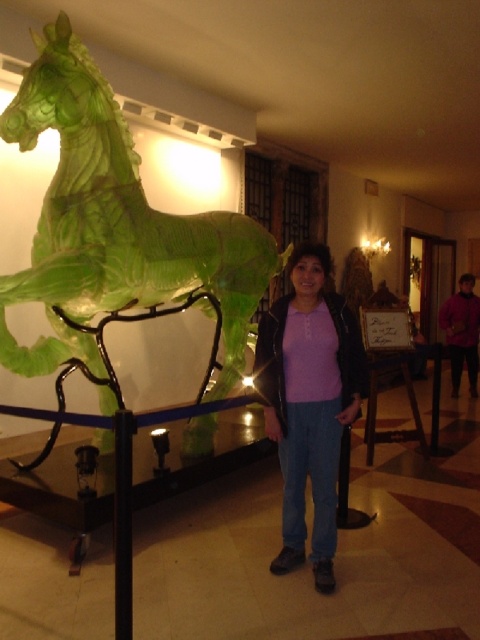
You are standing in the room with the glass horse sculpture and want to take a photo. There are two points marked in the scene, point A at coordinates point (36, 124) and point B at coordinates point (462, 304). Which point should you focus on to ensure the sculpture is in sharp focus?

You should focus on point A at coordinates point (36, 124) because it is closer to the camera than point B at coordinates point (462, 304), ensuring the sculpture remains sharp.

You are an interior designer assessing the space. You need to determine if the green glass horse at left can fit through a doorway that is the same width as the purple sweater at center. Based on their sizes, what would you advise?

The green glass horse at left is wider than the purple sweater at center, so it may not fit through the doorway which is only as wide as the purple sweater at center.